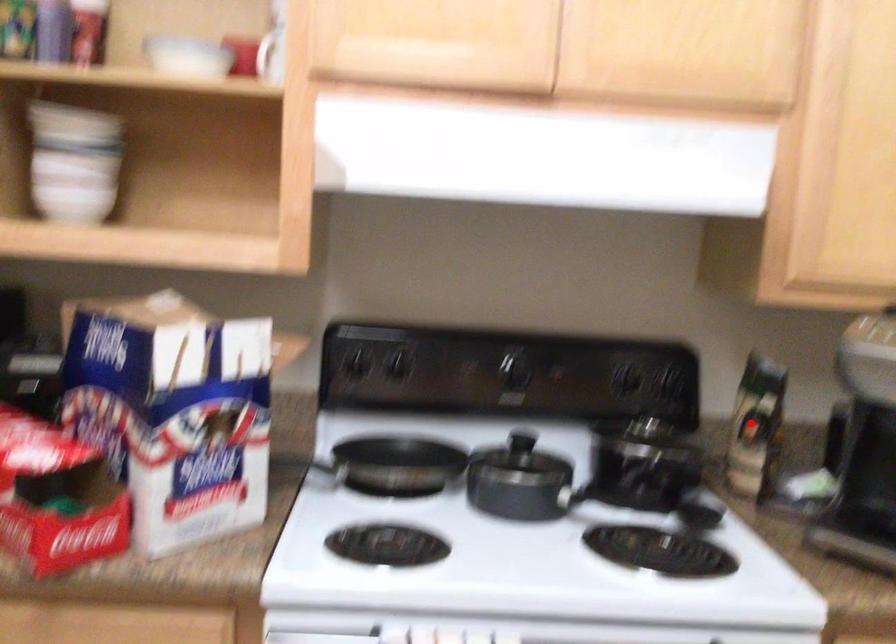
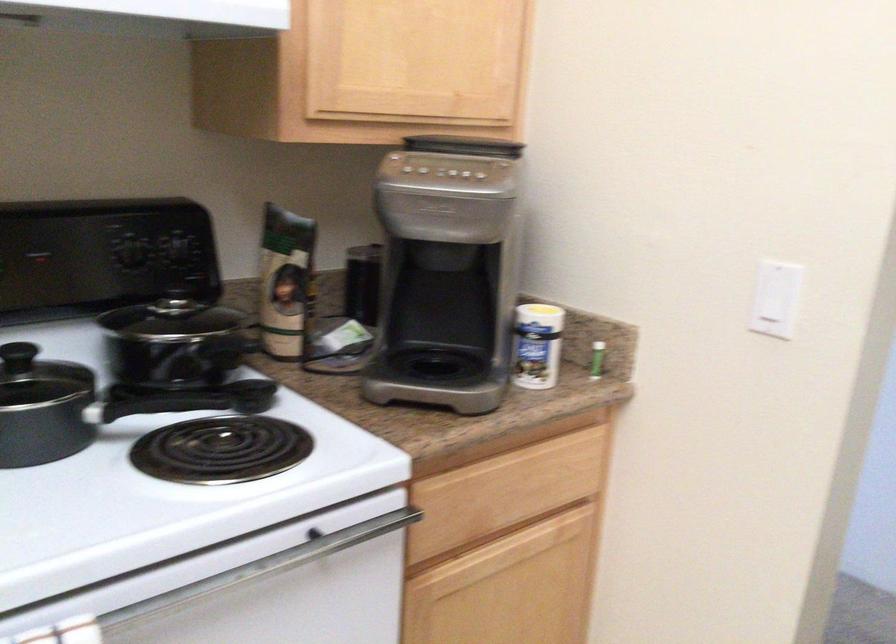
Find the pixel in the second image that matches the highlighted location in the first image.

(286, 281)